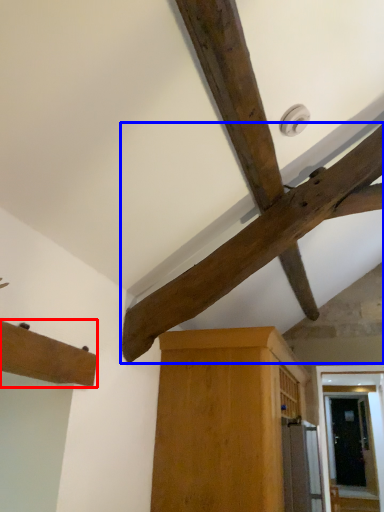
Question: Among these objects, which one is nearest to the camera, cabinetry (highlighted by a red box) or beam (highlighted by a blue box)?

Choices:
 (A) cabinetry
 (B) beam

Answer: (A)